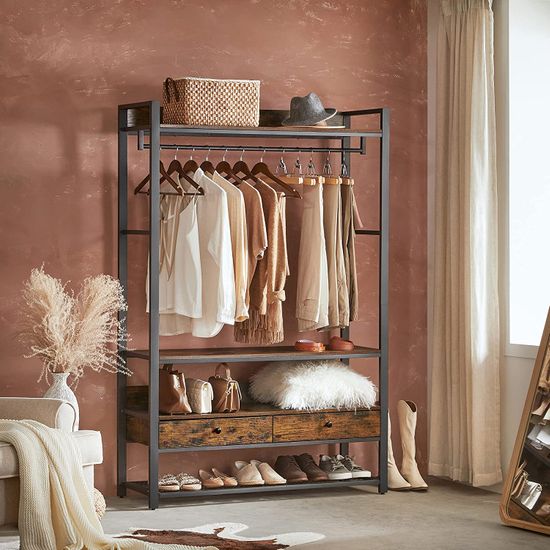
In order to click on shoes on shelf in this screenshot , I will do coord(166,478), coord(186,481), coord(210,477), coord(230,478), coord(246,475), coord(273,478), coord(295,476), coord(314,475), coord(343,471), coord(359,471).